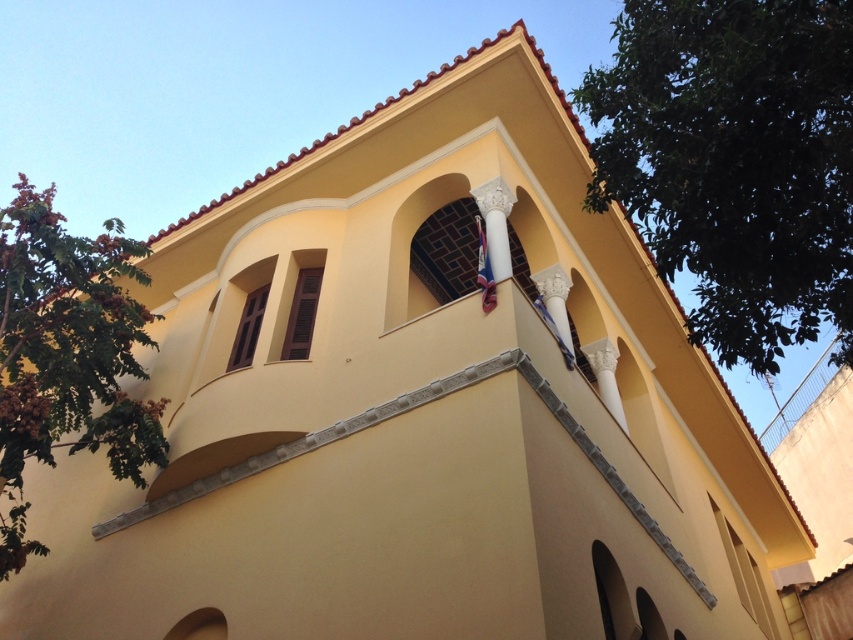
You are standing in front of the building and want to take a photo that includes both the green leafy tree at upper right and the green leafy tree at left. Which tree should you position to your right side to capture both in the frame?

The green leafy tree at upper right is positioned on the right side of green leafy tree at left, so to include both in the frame, position the green leafy tree at left to your left and the green leafy tree at upper right to your right.

You are standing in front of the two story building and want to know which tree has a smaller width between the green leafy tree at upper right and the green leafy tree at left?

The green leafy tree at upper right is thinner than the green leafy tree at left, so the green leafy tree at upper right has a smaller width.

You are a landscape architect planning to install a new pathway between the two green leafy trees. The pathway needs to be at least 70 feet long to accommodate a walking trail. Based on the image, will the distance between the green leafy tree at upper right and the green leafy tree at left be sufficient for the pathway?

The green leafy tree at upper right is 68.89 feet from the green leafy tree at left. Since the required pathway length is 70 feet, the distance is insufficient by approximately 1.11 feet.